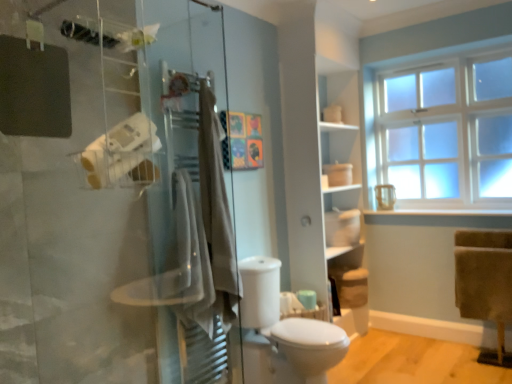
This screenshot has width=512, height=384. What do you see at coordinates (119, 151) in the screenshot? I see `white matte toilet paper at left` at bounding box center [119, 151].

This screenshot has width=512, height=384. In order to click on white frosted glass window at upper right in this screenshot , I will do `click(442, 126)`.

The image size is (512, 384). Find the location of `white matte shelf at center`. white matte shelf at center is located at coordinates (341, 138).

Considering the relative sizes of white matte shelf at center and transparent glass shower door at left in the image provided, is white matte shelf at center shorter than transparent glass shower door at left?

In fact, white matte shelf at center may be taller than transparent glass shower door at left.

Consider the image. What's the angular difference between white matte shelf at center and transparent glass shower door at left's facing directions?

The angle between the facing direction of white matte shelf at center and the facing direction of transparent glass shower door at left is 180 degrees.

Find the location of a particular element. Image resolution: width=512 pixels, height=384 pixels. shelf below the transparent glass shower door at left (from a real-world perspective) is located at coordinates (341, 138).

Is white matte shelf at center in front of or behind transparent glass shower door at left in the image?

Visually, white matte shelf at center is located behind transparent glass shower door at left.

From a real-world perspective, which is physically above, white glossy toilet at center or beige cotton towel at center, which ranks as the second bath towel in front-to-back order?

From a 3D spatial view, beige cotton towel at center, which ranks as the second bath towel in front-to-back order, is above.

Who is bigger, white glossy toilet at center or beige cotton towel at center, the first bath towel positioned from the back?

white glossy toilet at center is bigger.

Does white glossy toilet at center have a lesser width compared to beige cotton towel at center, which ranks as the second bath towel in front-to-back order?

Incorrect, the width of white glossy toilet at center is not less than that of beige cotton towel at center, which ranks as the second bath towel in front-to-back order.

Which of these two, white glossy toilet at center or beige cotton towel at center, which ranks as the second bath towel in front-to-back order, stands taller?

With more height is beige cotton towel at center, which ranks as the second bath towel in front-to-back order.

From the image's perspective, would you say white matte shelf at center is positioned over beige cotton bath towel at center, the 1th bath towel when ordered from front to back?

Yes.

From the picture: Between white matte shelf at center and beige cotton bath towel at center, the 1th bath towel when ordered from front to back, which one has smaller width?

white matte shelf at center is thinner.

Considering the relative positions of white matte shelf at center and beige cotton bath towel at center, the 1th bath towel when ordered from front to back, in the image provided, is white matte shelf at center to the left or to the right of beige cotton bath towel at center, the 1th bath towel when ordered from front to back,?

Based on their positions, white matte shelf at center is located to the right of beige cotton bath towel at center, the 1th bath towel when ordered from front to back.

Is white matte shelf at center oriented towards beige cotton bath towel at center, which ranks as the second bath towel in back-to-front order?

No, white matte shelf at center is not turned towards beige cotton bath towel at center, which ranks as the second bath towel in back-to-front order.

Is beige cotton towel at center, the first bath towel positioned from the back, placed right next to beige cotton bath towel at center, which ranks as the second bath towel in back-to-front order?

beige cotton towel at center, the first bath towel positioned from the back, and beige cotton bath towel at center, which ranks as the second bath towel in back-to-front order, are clearly separated.

Is beige cotton towel at center, the first bath towel positioned from the back, facing towards beige cotton bath towel at center, the 1th bath towel when ordered from front to back?

No, beige cotton towel at center, the first bath towel positioned from the back, is not turned towards beige cotton bath towel at center, the 1th bath towel when ordered from front to back.

Which is behind, point (204, 135) or point (202, 286)?

Point (204, 135)

Considering the positions of objects beige cotton towel at center, which ranks as the second bath towel in front-to-back order, and beige cotton bath towel at center, which ranks as the second bath towel in back-to-front order, in the image provided, who is behind, beige cotton towel at center, which ranks as the second bath towel in front-to-back order, or beige cotton bath towel at center, which ranks as the second bath towel in back-to-front order,?

beige cotton towel at center, which ranks as the second bath towel in front-to-back order, is further from the camera.

From the image's perspective, is transparent glass shower door at left above or below white glossy toilet at center?

Based on their image positions, transparent glass shower door at left is located above white glossy toilet at center.

Which is closer to the camera, (112, 215) or (329, 338)?

The point (112, 215) is closer to the camera.

In order to click on gray located on the right of transparent glass shower door at left in this screenshot , I will do `click(282, 332)`.

From the image's perspective, is white matte toilet paper at left located above or below beige cotton bath towel at center, the 1th bath towel when ordered from front to back?

From the image's perspective, white matte toilet paper at left appears above beige cotton bath towel at center, the 1th bath towel when ordered from front to back.

Is the depth of white matte toilet paper at left less than that of beige cotton bath towel at center, which ranks as the second bath towel in back-to-front order?

Yes, white matte toilet paper at left is in front of beige cotton bath towel at center, which ranks as the second bath towel in back-to-front order.

Considering the sizes of white matte toilet paper at left and beige cotton bath towel at center, the 1th bath towel when ordered from front to back, in the image, is white matte toilet paper at left wider or thinner than beige cotton bath towel at center, the 1th bath towel when ordered from front to back,?

In the image, white matte toilet paper at left appears to be more narrow than beige cotton bath towel at center, the 1th bath towel when ordered from front to back.

Identify the location of the 1st bath towel counting from the right of the white matte toilet paper at left. (196, 255).

How different are the orientations of transparent glass shower door at left and white matte toilet paper at left in degrees?

They differ by 180 degrees in their facing directions.

Does transparent glass shower door at left contain white matte toilet paper at left?

Definitely not — white matte toilet paper at left is not inside transparent glass shower door at left.

I want to click on shower door below the white matte toilet paper at left (from the image's perspective), so click(x=103, y=200).

From the image's perspective, between transparent glass shower door at left and white matte toilet paper at left, which one is located above?

white matte toilet paper at left appears higher in the image.

Where is `shower door on the left of white matte shelf at center`? The width and height of the screenshot is (512, 384). shower door on the left of white matte shelf at center is located at coordinates (103, 200).

Find the location of a particular element. The image size is (512, 384). the 1st bath towel in front when counting from the white glossy toilet at center is located at coordinates (217, 211).

From the picture: From the image, which object appears to be farther from beige cotton bath towel at center, the 1th bath towel when ordered from front to back, beige cotton towel at center, which ranks as the second bath towel in front-to-back order, or white glossy toilet at center?

white glossy toilet at center.

Which object lies further to the anchor point beige cotton towel at center, the first bath towel positioned from the back, white frosted glass window at upper right or transparent glass shower door at left?

The object further to beige cotton towel at center, the first bath towel positioned from the back, is white frosted glass window at upper right.

Looking at the image, which one is located closer to white matte toilet paper at left, white frosted glass window at upper right or white matte shelf at center?

The object closer to white matte toilet paper at left is white matte shelf at center.

From the image, which object appears to be farther from transparent glass shower door at left, white matte shelf at center or white matte toilet paper at left?

Among the two, white matte shelf at center is located further to transparent glass shower door at left.

Which object lies further to the anchor point white glossy toilet at center, beige cotton towel at center, which ranks as the second bath towel in front-to-back order, or white matte toilet paper at left?

white matte toilet paper at left is further to white glossy toilet at center.

Looking at the image, which one is located further to white glossy toilet at center, white frosted glass window at upper right or transparent glass shower door at left?

white frosted glass window at upper right is further to white glossy toilet at center.

From the image, which object appears to be farther from white matte toilet paper at left, beige cotton bath towel at center, the 1th bath towel when ordered from front to back, or white matte shelf at center?

The object further to white matte toilet paper at left is white matte shelf at center.

Based on their spatial positions, is beige cotton bath towel at center, which ranks as the second bath towel in back-to-front order, or beige cotton towel at center, which ranks as the second bath towel in front-to-back order, further from white matte toilet paper at left?

Among the two, beige cotton bath towel at center, which ranks as the second bath towel in back-to-front order, is located further to white matte toilet paper at left.

Where is `gray located between transparent glass shower door at left and white matte shelf at center in the depth direction`? This screenshot has height=384, width=512. gray located between transparent glass shower door at left and white matte shelf at center in the depth direction is located at coordinates (282, 332).

Identify the location of gray between transparent glass shower door at left and white frosted glass window at upper right along the z-axis. This screenshot has width=512, height=384. (282, 332).

You are a GUI agent. You are given a task and a screenshot of the screen. Output one action in this format:
    pyautogui.click(x=<x>, y=<y>)
    Task: Click on the gray between beige cotton bath towel at center, which ranks as the second bath towel in back-to-front order, and white frosted glass window at upper right
    This screenshot has height=384, width=512.
    Given the screenshot: What is the action you would take?
    pyautogui.click(x=282, y=332)

The height and width of the screenshot is (384, 512). I want to click on gray positioned between white matte toilet paper at left and white matte shelf at center from near to far, so [x=282, y=332].